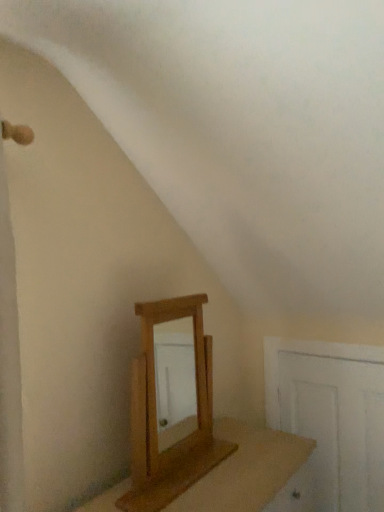
The width and height of the screenshot is (384, 512). In order to click on white wooden door at lower right in this screenshot , I will do `click(337, 425)`.

What do you see at coordinates (155, 391) in the screenshot? I see `light brown wooden mirror at center` at bounding box center [155, 391].

Measure the distance between point (287,441) and camera.

Point (287,441) is 5.65 feet from camera.

Identify the location of white wooden door at lower right. The width and height of the screenshot is (384, 512). (337, 425).

Can you tell me how much wooden table at center and light brown wooden mirror at center differ in facing direction?

There is a 0.656-degree angle between the facing directions of wooden table at center and light brown wooden mirror at center.

Are wooden table at center and light brown wooden mirror at center located far from each other?

No, wooden table at center is in close proximity to light brown wooden mirror at center.

Is wooden table at center in front of light brown wooden mirror at center?

Yes, the depth of wooden table at center is less than that of light brown wooden mirror at center.

Considering the points (220, 482) and (155, 442), which point is behind, point (220, 482) or point (155, 442)?

Point (155, 442)

Locate an element on the screen. door located above the wooden table at center (from a real-world perspective) is located at coordinates (337, 425).

From the picture: Relative to white wooden door at lower right, is wooden table at center in front or behind?

wooden table at center is in front of white wooden door at lower right.

Is point (303, 460) more distant than point (278, 391)?

No, (303, 460) is closer to viewer.

Image resolution: width=384 pixels, height=512 pixels. What are the coordinates of `mirror positioned vertically above the white wooden door at lower right (from a real-world perspective)` in the screenshot? It's located at click(155, 391).

Do you think light brown wooden mirror at center is within white wooden door at lower right, or outside of it?

The correct answer is: outside.

Considering the sizes of light brown wooden mirror at center and white wooden door at lower right in the image, is light brown wooden mirror at center taller or shorter than white wooden door at lower right?

Considering their sizes, light brown wooden mirror at center has less height than white wooden door at lower right.

Looking at this image, considering the relative sizes of white wooden door at lower right and wooden table at center in the image provided, is white wooden door at lower right bigger than wooden table at center?

No, white wooden door at lower right is not bigger than wooden table at center.

At what (x,y) coordinates should I click in order to perform the action: click on table in front of the white wooden door at lower right. Please return your answer as a coordinate pair (x, y). Looking at the image, I should click on (246, 470).

Is white wooden door at lower right in front of wooden table at center?

No, white wooden door at lower right is further to the viewer.

Is white wooden door at lower right positioned beyond the bounds of wooden table at center?

white wooden door at lower right lies outside wooden table at center's area.

Looking at this image, is white wooden door at lower right shorter than light brown wooden mirror at center?

No.

Is white wooden door at lower right not within light brown wooden mirror at center?

That's correct, white wooden door at lower right is outside of light brown wooden mirror at center.

Considering the relative sizes of light brown wooden mirror at center and wooden table at center in the image provided, is light brown wooden mirror at center smaller than wooden table at center?

Indeed, light brown wooden mirror at center has a smaller size compared to wooden table at center.

Based on the photo, which is correct: light brown wooden mirror at center is inside wooden table at center, or outside of it?

light brown wooden mirror at center exists outside the volume of wooden table at center.

Is light brown wooden mirror at center wider than wooden table at center?

No, light brown wooden mirror at center is not wider than wooden table at center.

Find the location of a particular element. mirror located on the left of wooden table at center is located at coordinates (155, 391).

Image resolution: width=384 pixels, height=512 pixels. I want to click on door located above the wooden table at center (from a real-world perspective), so click(337, 425).

When comparing their distances from wooden table at center, does light brown wooden mirror at center or white wooden door at lower right seem further?

white wooden door at lower right.

Looking at the image, which one is located closer to light brown wooden mirror at center, white wooden door at lower right or wooden table at center?

Based on the image, wooden table at center appears to be nearer to light brown wooden mirror at center.

In the scene shown: Based on their spatial positions, is white wooden door at lower right or light brown wooden mirror at center further from wooden table at center?

white wooden door at lower right.

Which object lies nearer to the anchor point white wooden door at lower right, light brown wooden mirror at center or wooden table at center?

wooden table at center lies closer to white wooden door at lower right than the other object.

From the image, which object appears to be nearer to light brown wooden mirror at center, wooden table at center or white wooden door at lower right?

The object closer to light brown wooden mirror at center is wooden table at center.

Estimate the real-world distances between objects in this image. Which object is further from white wooden door at lower right, wooden table at center or light brown wooden mirror at center?

The object further to white wooden door at lower right is light brown wooden mirror at center.

What are the coordinates of `mirror located between wooden table at center and white wooden door at lower right in the depth direction` in the screenshot? It's located at (155, 391).